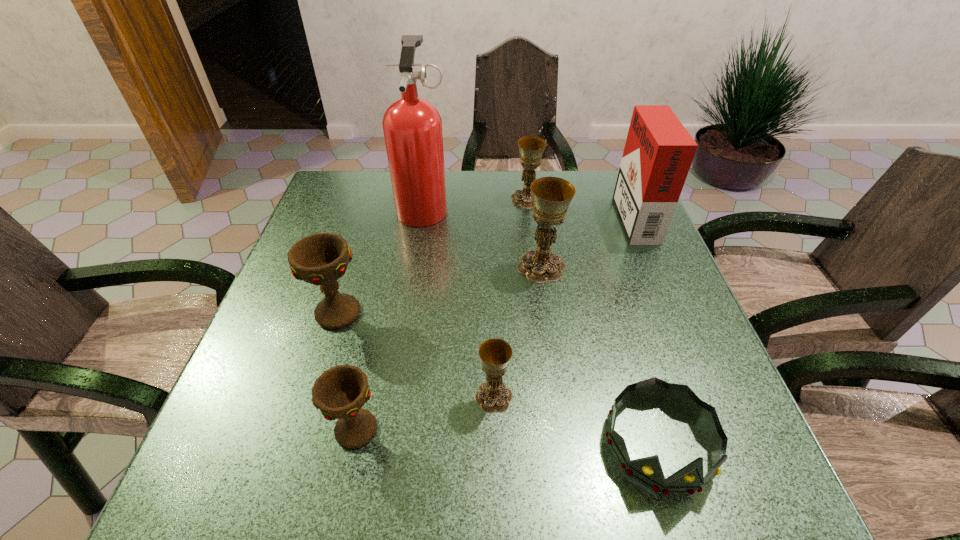
Image resolution: width=960 pixels, height=540 pixels. In order to click on the tallest object in this screenshot , I will do `click(412, 126)`.

You are a GUI agent. You are given a task and a screenshot of the screen. Output one action in this format:
    pyautogui.click(x=<x>, y=<y>)
    Task: Click on the cigarette case
    
    Given the screenshot: What is the action you would take?
    pyautogui.click(x=658, y=153)

The height and width of the screenshot is (540, 960). Identify the location of red cigarette case. (658, 153).

This screenshot has height=540, width=960. Find the location of `the biggest gold chalice`. the biggest gold chalice is located at coordinates (551, 196).

Identify the location of the fourth nearest chalice. (551, 196).

At what (x,y) coordinates should I click in order to perform the action: click on the farthest chalice. Please return your answer as a coordinate pair (x, y). The image size is (960, 540). Looking at the image, I should click on (531, 148).

I want to click on the farthest gold chalice, so click(x=531, y=148).

The height and width of the screenshot is (540, 960). I want to click on the fourth nearest object, so click(321, 259).

You are a GUI agent. You are given a task and a screenshot of the screen. Output one action in this format:
    pyautogui.click(x=<x>, y=<y>)
    Task: Click on the bigger red chalice
    The image size is (960, 540).
    Given the screenshot: What is the action you would take?
    pyautogui.click(x=321, y=259)

At what (x,y) coordinates should I click in order to perform the action: click on the nearest gold chalice. Please return your answer as a coordinate pair (x, y). This screenshot has width=960, height=540. Looking at the image, I should click on (492, 396).